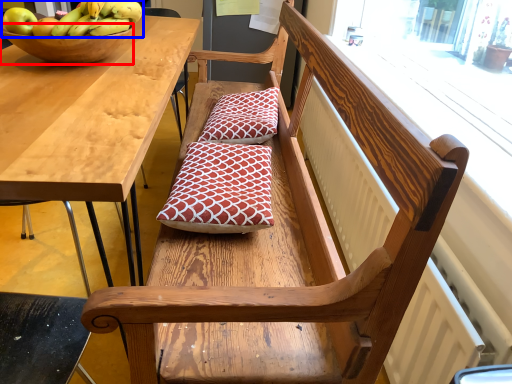
Question: Among these objects, which one is nearest to the camera, bowl (highlighted by a red box) or banana (highlighted by a blue box)?

Choices:
 (A) bowl
 (B) banana

Answer: (B)